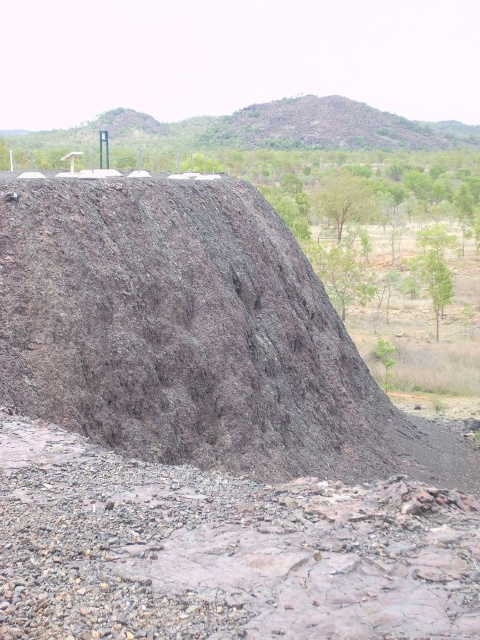
Question: Which of the following is the closest to the observer?

Choices:
 (A) (277, 104)
 (B) (79, 572)

Answer: (B)

Question: Does brown gravel at center have a smaller size compared to brown rough rock at upper center?

Choices:
 (A) yes
 (B) no

Answer: (A)

Question: Is brown gravel at center bigger than brown rough rock at upper center?

Choices:
 (A) yes
 (B) no

Answer: (B)

Question: Which point is farther to the camera?

Choices:
 (A) brown rough rock at upper center
 (B) brown gravel at center

Answer: (A)

Question: Where is brown gravel at center located in relation to brown rough rock at upper center in the image?

Choices:
 (A) right
 (B) left

Answer: (B)

Question: Among these objects, which one is nearest to the camera?

Choices:
 (A) brown rough rock at upper center
 (B) brown gravel at center

Answer: (B)